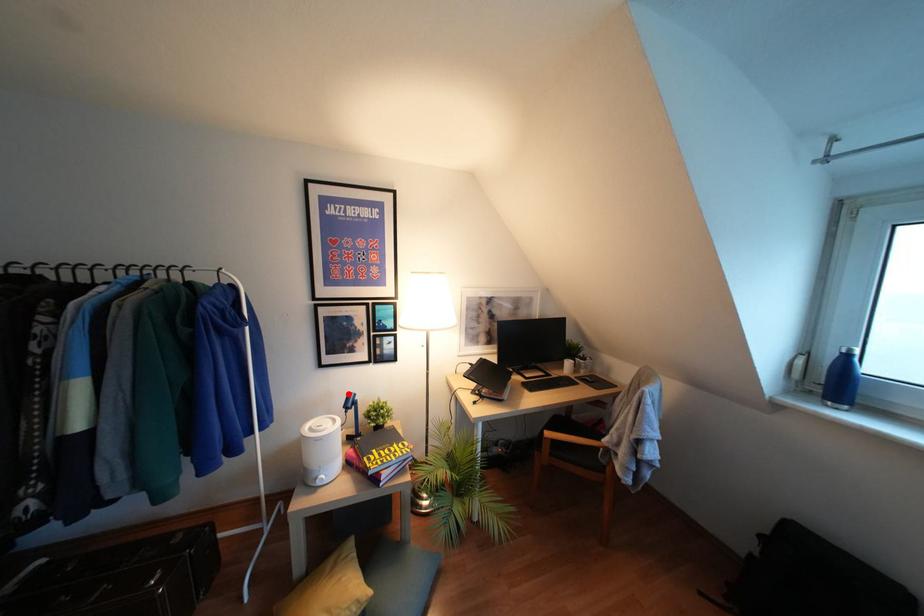
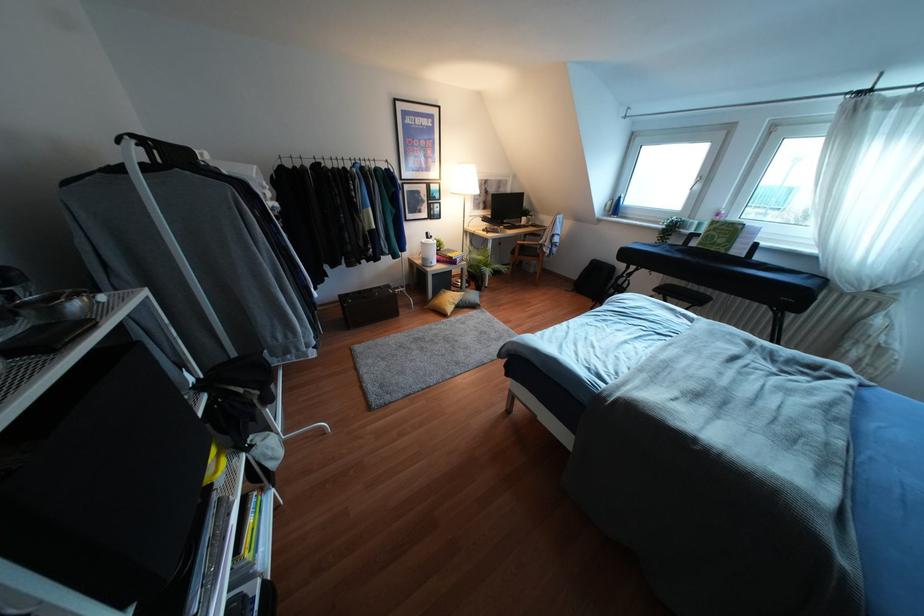
Question: A red point is marked in image1. In image2, is the corresponding 3D point closer to the camera or farther? Reply with the corresponding letter.

Choices:
 (A) The corresponding 3D point is closer.
 (B) The corresponding 3D point is farther.

Answer: (A)